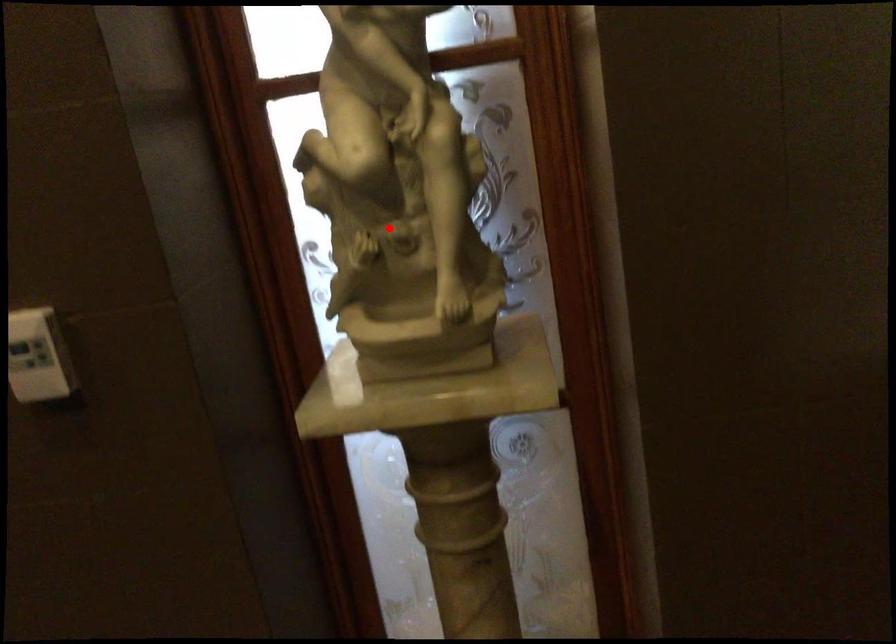
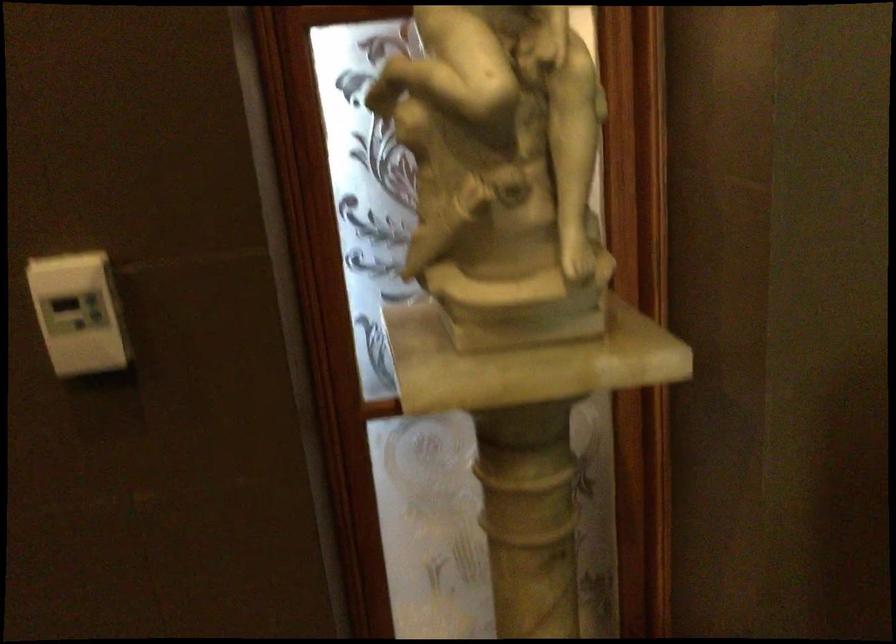
Where in the second image is the point corresponding to the highlighted location from the first image?

(502, 172)